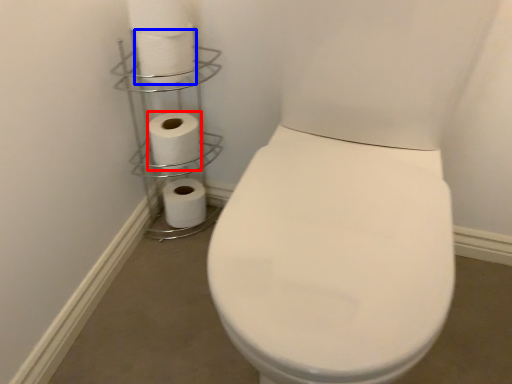
Question: Which object appears farthest to the camera in this image, toilet paper (highlighted by a red box) or toilet paper (highlighted by a blue box)?

Choices:
 (A) toilet paper
 (B) toilet paper

Answer: (A)